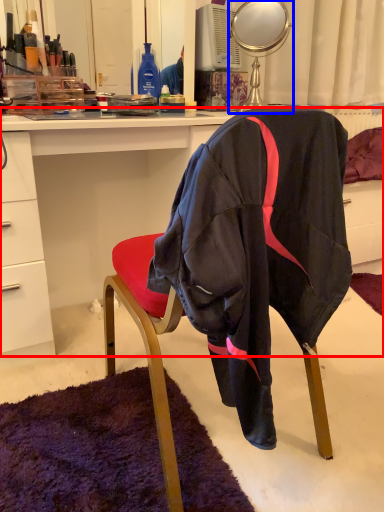
Question: Which object appears farthest to the camera in this image, desk (highlighted by a red box) or mirror (highlighted by a blue box)?

Choices:
 (A) desk
 (B) mirror

Answer: (B)